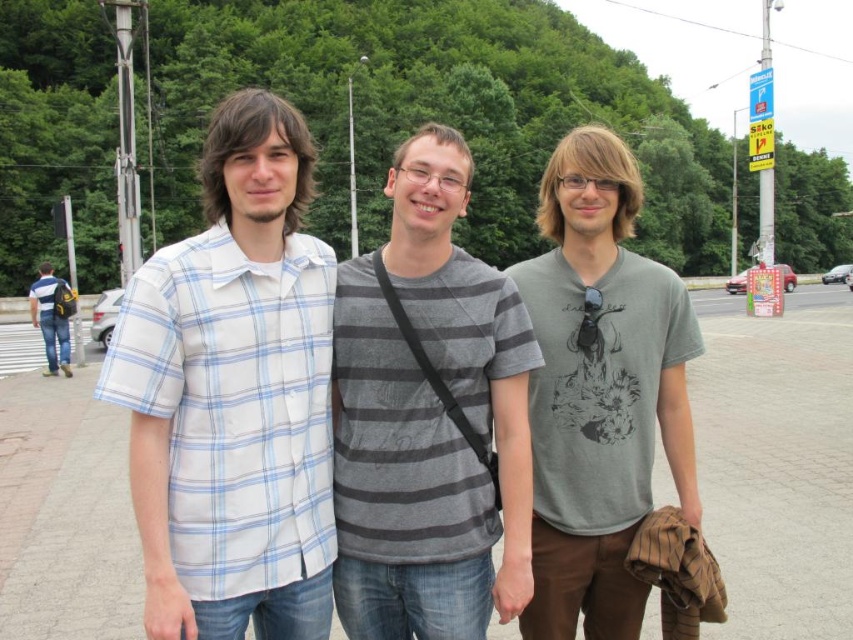
Question: Which point is farther from the camera taking this photo?

Choices:
 (A) (585, 566)
 (B) (45, 324)
 (C) (465, 566)

Answer: (B)

Question: Estimate the real-world distances between objects in this image. Which object is closer to the gray striped t-shirt at center?

Choices:
 (A) matte blue jeans at left
 (B) gray matte t-shirt at center

Answer: (B)

Question: Is white plaid shirt at left above gray matte t-shirt at center?

Choices:
 (A) yes
 (B) no

Answer: (B)

Question: Is gray concrete pavement at center above matte blue jeans at left?

Choices:
 (A) yes
 (B) no

Answer: (B)

Question: Is gray concrete pavement at center closer to the viewer compared to gray striped t-shirt at center?

Choices:
 (A) no
 (B) yes

Answer: (A)

Question: Which point is farther to the camera?

Choices:
 (A) (38, 316)
 (B) (77, 604)
 (C) (579, 371)

Answer: (A)